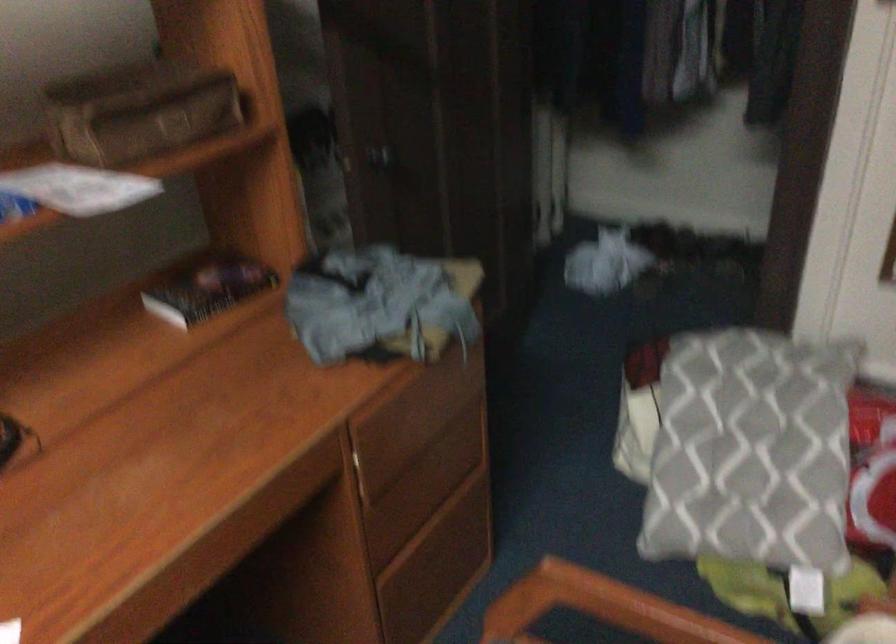
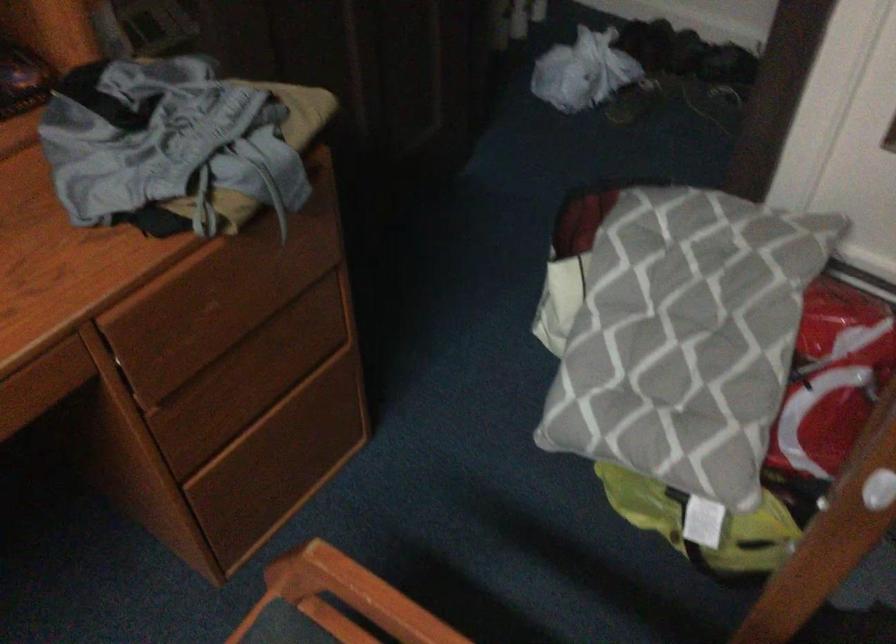
The point at (401, 412) is marked in the first image. Where is the corresponding point in the second image?

(196, 294)